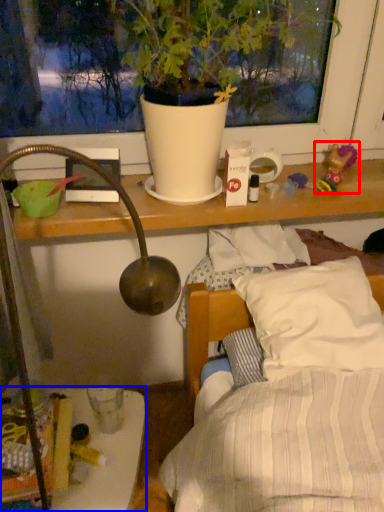
Question: Which object is closer to the camera taking this photo, toy (highlighted by a red box) or furniture (highlighted by a blue box)?

Choices:
 (A) toy
 (B) furniture

Answer: (B)